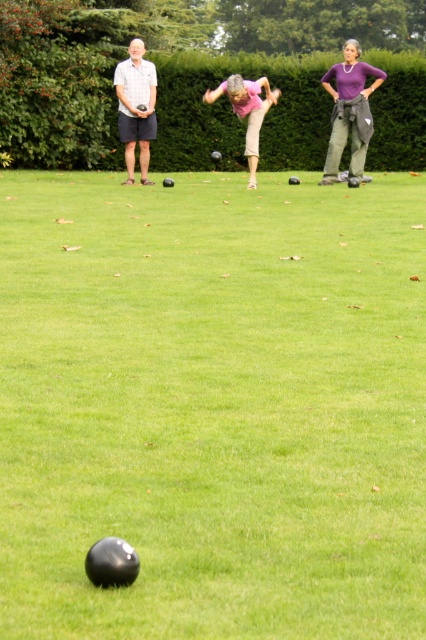
You are a person standing at the edge of the green grass at center and want to walk to the matte gray shorts at left. How many steps would you need to take if each step covers approximately 2.5 feet?

The distance between green grass at center and matte gray shorts at left is 22.37 feet. Dividing this by 2.5 feet per step gives approximately 8.95 steps. Since you can only take whole steps, you would need to take 9 steps to reach matte gray shorts at left.